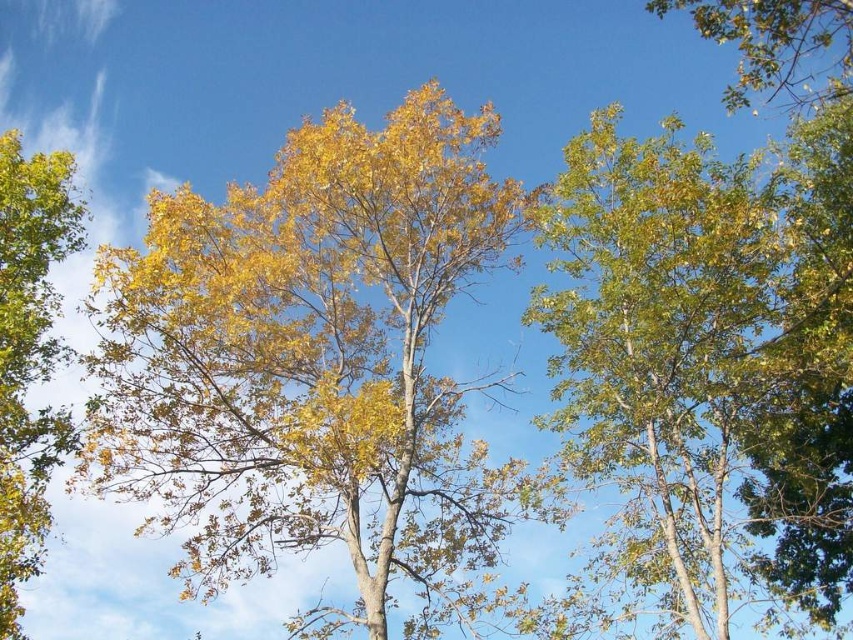
Between yellow-green leaves at center and green matte tree at left, which one has less height?

yellow-green leaves at center is shorter.

In order to click on yellow-green leaves at center in this screenshot , I will do `click(316, 369)`.

Measure the distance between yellow-green leaves at center and camera.

48.05 feet

Locate an element on the screen. The height and width of the screenshot is (640, 853). yellow-green leaves at center is located at coordinates (316, 369).

Does yellow-green leaves at center come in front of green matte tree at upper right?

Yes, it is in front of green matte tree at upper right.

Locate an element on the screen. yellow-green leaves at center is located at coordinates (316, 369).

Find the location of `yellow-green leaves at center`. yellow-green leaves at center is located at coordinates (316, 369).

Between point (828, 369) and point (0, 518), which one is positioned behind?

The point (828, 369) is more distant.

Does point (786, 364) come behind point (1, 630)?

Yes, point (786, 364) is farther from viewer.

The width and height of the screenshot is (853, 640). I want to click on green matte tree at upper right, so click(708, 358).